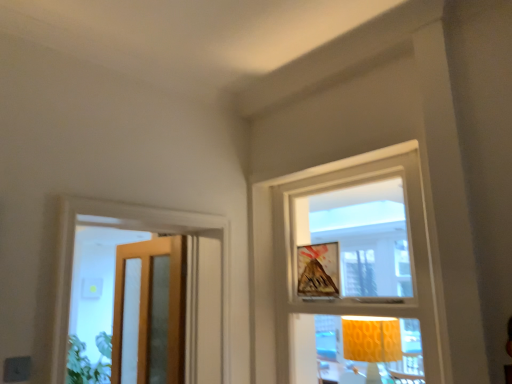
Question: Is matte wooden picture frame at upper center positioned with its back to white textured frame at upper center, which is the 2th window from left to right?

Choices:
 (A) no
 (B) yes

Answer: (B)

Question: Considering the relative sizes of matte wooden picture frame at upper center and white textured frame at upper center, which is the 2th window from left to right, in the image provided, is matte wooden picture frame at upper center taller than white textured frame at upper center, which is the 2th window from left to right,?

Choices:
 (A) yes
 (B) no

Answer: (B)

Question: Is white textured frame at upper center, the first window positioned from the right, inside matte wooden picture frame at upper center?

Choices:
 (A) yes
 (B) no

Answer: (B)

Question: From a real-world perspective, is matte wooden picture frame at upper center on white textured frame at upper center, the first window positioned from the right?

Choices:
 (A) yes
 (B) no

Answer: (A)

Question: Considering the relative sizes of matte wooden picture frame at upper center and white textured frame at upper center, the first window positioned from the right, in the image provided, is matte wooden picture frame at upper center smaller than white textured frame at upper center, the first window positioned from the right,?

Choices:
 (A) yes
 (B) no

Answer: (A)

Question: From the image's perspective, is matte wooden picture frame at upper center over white textured frame at upper center, which is the 2th window from left to right?

Choices:
 (A) no
 (B) yes

Answer: (B)

Question: Is there a large distance between wooden glass door at left and clear glass door at left, arranged as the 2th window when viewed from the right?

Choices:
 (A) yes
 (B) no

Answer: (B)

Question: Can you confirm if wooden glass door at left is shorter than clear glass door at left, arranged as the 2th window when viewed from the right?

Choices:
 (A) yes
 (B) no

Answer: (B)

Question: Is wooden glass door at left in contact with clear glass door at left, arranged as the 2th window when viewed from the right?

Choices:
 (A) yes
 (B) no

Answer: (B)

Question: Is wooden glass door at left aimed at clear glass door at left, which ranks as the 1th window in left-to-right order?

Choices:
 (A) yes
 (B) no

Answer: (B)

Question: Would you say wooden glass door at left is outside clear glass door at left, arranged as the 2th window when viewed from the right?

Choices:
 (A) yes
 (B) no

Answer: (A)

Question: Is the depth of wooden glass door at left less than that of clear glass door at left, arranged as the 2th window when viewed from the right?

Choices:
 (A) yes
 (B) no

Answer: (B)

Question: Is clear glass door at left, arranged as the 2th window when viewed from the right, located outside wooden glass door at left?

Choices:
 (A) no
 (B) yes

Answer: (B)